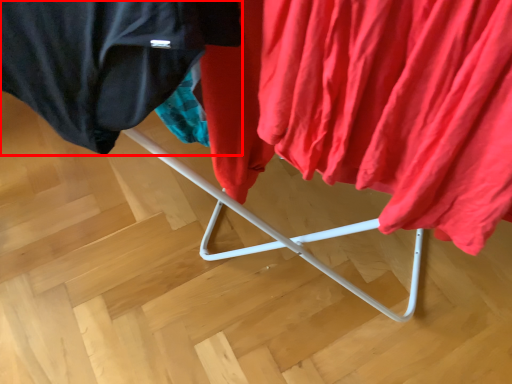
Question: In this image, where is cloak (annotated by the red box) located relative to curtain?

Choices:
 (A) left
 (B) right

Answer: (A)